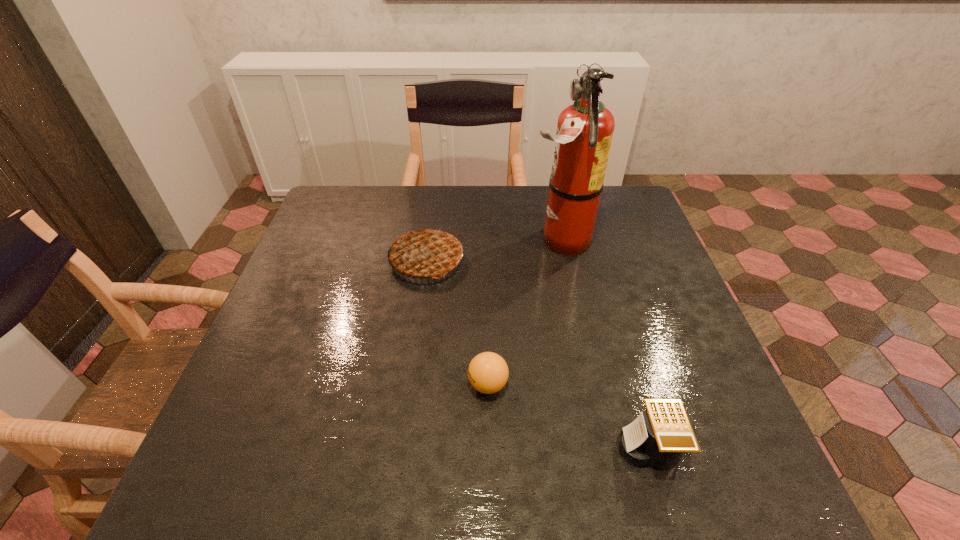
I want to click on vacant area between the calculator and the tallest object, so click(604, 345).

You are a GUI agent. You are given a task and a screenshot of the screen. Output one action in this format:
    pyautogui.click(x=<x>, y=<y>)
    Task: Click on the empty space that is in between the second object from left to right and the second tallest object
    This screenshot has height=540, width=960.
    Given the screenshot: What is the action you would take?
    pyautogui.click(x=457, y=323)

This screenshot has height=540, width=960. I want to click on blank region between the ping-pong ball and the calculator, so click(x=568, y=416).

This screenshot has width=960, height=540. I want to click on free space between the calculator and the second tallest object, so click(x=538, y=355).

Locate which object ranks third in proximity to the second nearest object. Please provide its 2D coordinates. Your answer should be formatted as a tuple, i.e. [(x, y)], where the tuple contains the x and y coordinates of a point satisfying the conditions above.

[(585, 129)]

Locate an element on the screen. The image size is (960, 540). object that is the third closest to the third farthest object is located at coordinates (585, 129).

Where is `free space that satisfies the following two spatial constraints: 1. on the side with brand of the second nearest object; 2. on the left side of the nearest object`? free space that satisfies the following two spatial constraints: 1. on the side with brand of the second nearest object; 2. on the left side of the nearest object is located at coordinates (489, 448).

Locate an element on the screen. free space in the image that satisfies the following two spatial constraints: 1. on the front side of the leftmost object; 2. on the left side of the nearest object is located at coordinates (401, 448).

Where is `free space that satisfies the following two spatial constraints: 1. on the front side of the leftmost object; 2. on the left side of the nearest object`? free space that satisfies the following two spatial constraints: 1. on the front side of the leftmost object; 2. on the left side of the nearest object is located at coordinates (401, 448).

Where is `blank area in the image that satisfies the following two spatial constraints: 1. on the side with brand of the third farthest object; 2. on the left side of the nearest object`? This screenshot has height=540, width=960. blank area in the image that satisfies the following two spatial constraints: 1. on the side with brand of the third farthest object; 2. on the left side of the nearest object is located at coordinates (489, 448).